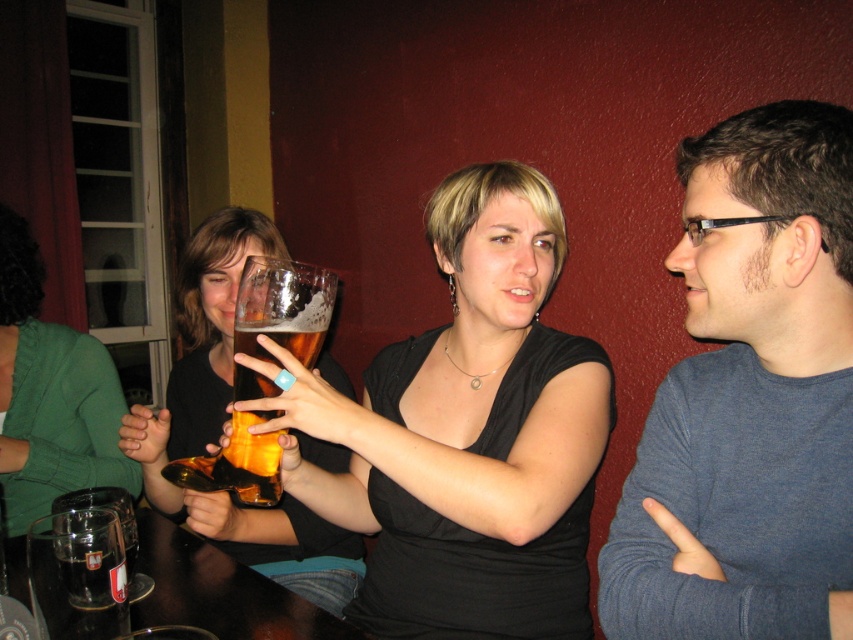
Is point (479, 324) closer to viewer compared to point (76, 584)?

No, (479, 324) is behind (76, 584).

What do you see at coordinates (468, 433) in the screenshot?
I see `matte black dress at center` at bounding box center [468, 433].

Locate an element on the screen. This screenshot has width=853, height=640. matte black dress at center is located at coordinates (468, 433).

You are a GUI agent. You are given a task and a screenshot of the screen. Output one action in this format:
    pyautogui.click(x=<x>, y=<y>)
    Task: Click on the matte black dress at center
    This screenshot has width=853, height=640.
    Given the screenshot: What is the action you would take?
    pyautogui.click(x=468, y=433)

Is green fabric shirt at left in front of translucent glass mug at lower left?

No, it is behind translucent glass mug at lower left.

Is the position of green fabric shirt at left more distant than that of translucent glass mug at lower left?

Yes, it is behind translucent glass mug at lower left.

You are a GUI agent. You are given a task and a screenshot of the screen. Output one action in this format:
    pyautogui.click(x=<x>, y=<y>)
    Task: Click on the green fabric shirt at left
    The image size is (853, 640).
    Given the screenshot: What is the action you would take?
    pyautogui.click(x=49, y=394)

Can you confirm if matte blue sweater at right is positioned above clear glass mug at lower left?

Correct, matte blue sweater at right is located above clear glass mug at lower left.

Where is `matte blue sweater at right`? matte blue sweater at right is located at coordinates (749, 397).

At what (x,y) coordinates should I click in order to perform the action: click on matte blue sweater at right. Please return your answer as a coordinate pair (x, y). Looking at the image, I should click on (749, 397).

Where is `matte blue sweater at right`? This screenshot has height=640, width=853. matte blue sweater at right is located at coordinates (749, 397).